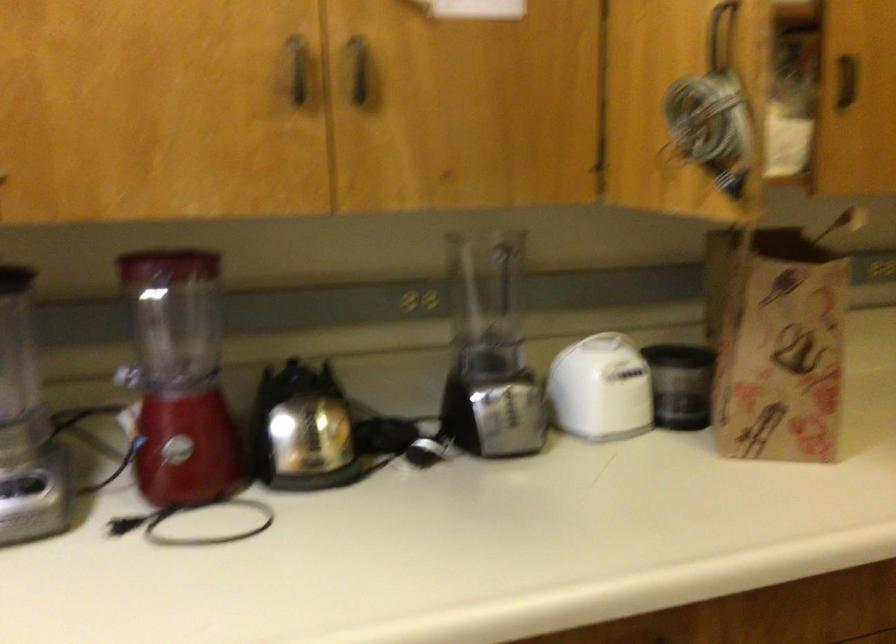
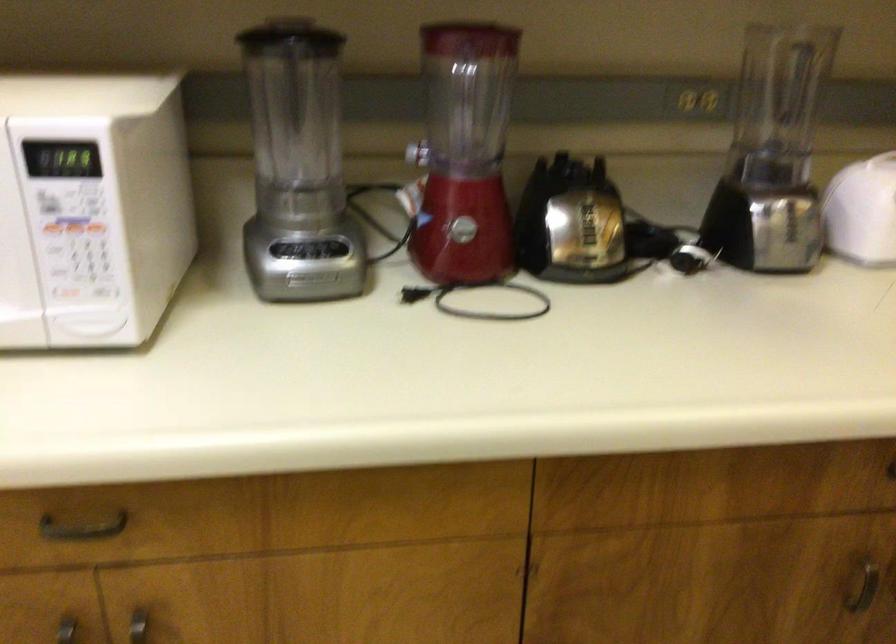
The point at (191,315) is marked in the first image. Where is the corresponding point in the second image?

(467, 93)